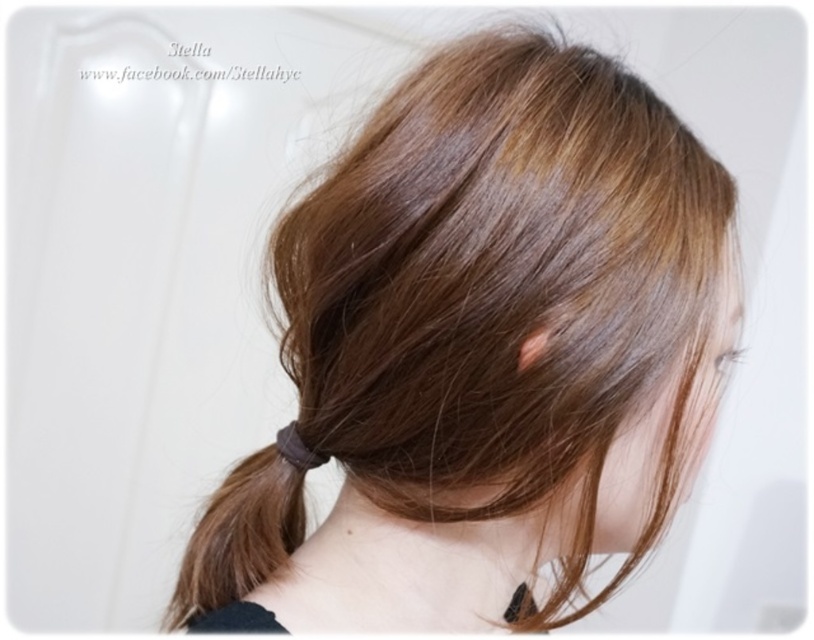
Question: Where is brown matte hair at center located in relation to brown rubber band at center in the image?

Choices:
 (A) left
 (B) right

Answer: (B)

Question: Does brown matte hair at center appear on the right side of brown rubber band at center?

Choices:
 (A) yes
 (B) no

Answer: (A)

Question: Which point is closer to the camera?

Choices:
 (A) (248, 612)
 (B) (333, 568)

Answer: (A)

Question: Where is brown matte hair at center located in relation to brown rubber band at center in the image?

Choices:
 (A) above
 (B) below

Answer: (A)